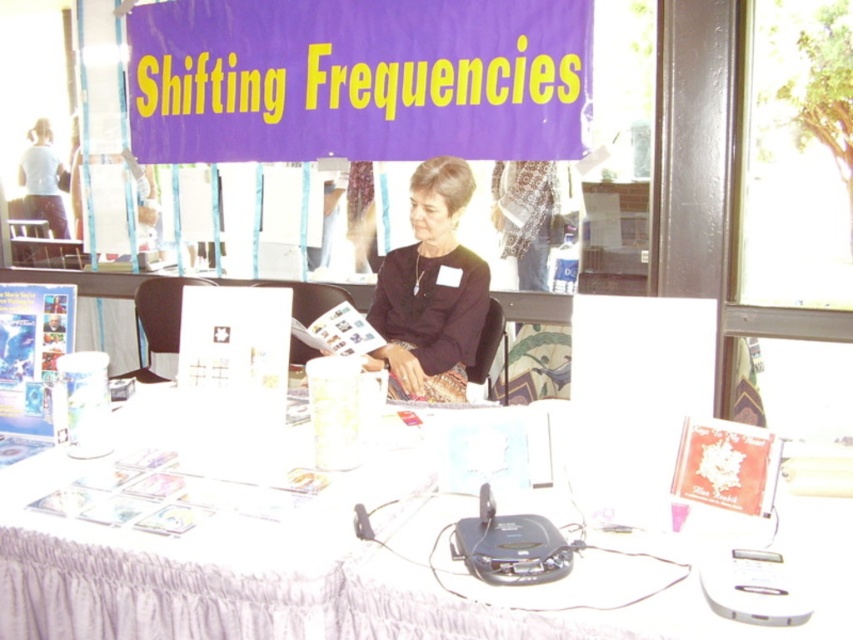
Image resolution: width=853 pixels, height=640 pixels. I want to click on white fabric tablecloth at lower center, so click(189, 557).

What do you see at coordinates (189, 557) in the screenshot? The image size is (853, 640). I see `white fabric tablecloth at lower center` at bounding box center [189, 557].

You are a GUI agent. You are given a task and a screenshot of the screen. Output one action in this format:
    pyautogui.click(x=<x>, y=<y>)
    Task: Click on the white fabric tablecloth at lower center
    
    Given the screenshot: What is the action you would take?
    pyautogui.click(x=189, y=557)

Where is `white fabric tablecloth at lower center`? The height and width of the screenshot is (640, 853). white fabric tablecloth at lower center is located at coordinates (189, 557).

Is point (228, 145) behind point (412, 202)?

Yes.

Is point (172, 74) positioned in front of point (418, 289)?

No, it is behind (418, 289).

You are a GUI agent. You are given a task and a screenshot of the screen. Output one action in this format:
    pyautogui.click(x=<x>, y=<y>)
    Task: Click on the purple fabric banner at upper center
    Image resolution: width=853 pixels, height=640 pixels.
    Given the screenshot: What is the action you would take?
    (358, 77)

Can you confirm if purple fabric banner at upper center is positioned below white fabric tablecloth at lower center?

Actually, purple fabric banner at upper center is above white fabric tablecloth at lower center.

This screenshot has width=853, height=640. Find the location of `purple fabric banner at upper center`. purple fabric banner at upper center is located at coordinates (358, 77).

Where is `purple fabric banner at upper center`? This screenshot has height=640, width=853. purple fabric banner at upper center is located at coordinates (358, 77).